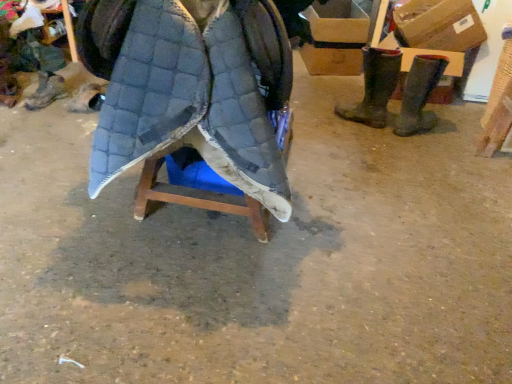
Question: Can you confirm if brown suede boots at right, which ranks as the first footwear in right-to-left order, is thinner than quilted fabric cloak at center?

Choices:
 (A) no
 (B) yes

Answer: (B)

Question: Can you confirm if brown suede boots at right, which ranks as the first footwear in right-to-left order, is bigger than quilted fabric cloak at center?

Choices:
 (A) no
 (B) yes

Answer: (A)

Question: Can we say brown suede boots at right, acting as the fourth footwear starting from the left, lies outside quilted fabric cloak at center?

Choices:
 (A) no
 (B) yes

Answer: (B)

Question: Does brown suede boots at right, acting as the fourth footwear starting from the left, turn towards quilted fabric cloak at center?

Choices:
 (A) yes
 (B) no

Answer: (A)

Question: From a real-world perspective, is brown suede boots at right, acting as the fourth footwear starting from the left, on top of quilted fabric cloak at center?

Choices:
 (A) no
 (B) yes

Answer: (A)

Question: Visually, is quilted fabric cloak at center positioned to the left or to the right of cardboard box at upper right, placed as the 2th cardboard box when sorted from back to front?

Choices:
 (A) left
 (B) right

Answer: (A)

Question: Considering the positions of quilted fabric cloak at center and cardboard box at upper right, which is counted as the 1th cardboard box, starting from the right, in the image, is quilted fabric cloak at center taller or shorter than cardboard box at upper right, which is counted as the 1th cardboard box, starting from the right,?

Choices:
 (A) tall
 (B) short

Answer: (A)

Question: Considering the positions of quilted fabric cloak at center and cardboard box at upper right, which ranks as the first cardboard box in front-to-back order, in the image, is quilted fabric cloak at center bigger or smaller than cardboard box at upper right, which ranks as the first cardboard box in front-to-back order,?

Choices:
 (A) big
 (B) small

Answer: (A)

Question: Is quilted fabric cloak at center inside or outside of cardboard box at upper right, which is counted as the 1th cardboard box, starting from the right?

Choices:
 (A) inside
 (B) outside

Answer: (B)

Question: Do you think brown rubber boots at right, arranged as the second footwear when viewed from the right, is within cardboard box at upper right, the 2th cardboard box from the left, or outside of it?

Choices:
 (A) outside
 (B) inside

Answer: (A)

Question: Is brown rubber boots at right, the 3th footwear from the left, in front of or behind cardboard box at upper right, placed as the 2th cardboard box when sorted from back to front, in the image?

Choices:
 (A) front
 (B) behind

Answer: (A)

Question: From the image's perspective, is brown rubber boots at right, arranged as the second footwear when viewed from the right, located above or below cardboard box at upper right, placed as the 2th cardboard box when sorted from back to front?

Choices:
 (A) below
 (B) above

Answer: (A)

Question: Considering the positions of brown rubber boots at right, arranged as the second footwear when viewed from the right, and cardboard box at upper right, which is counted as the 1th cardboard box, starting from the right, in the image, is brown rubber boots at right, arranged as the second footwear when viewed from the right, bigger or smaller than cardboard box at upper right, which is counted as the 1th cardboard box, starting from the right,?

Choices:
 (A) big
 (B) small

Answer: (B)

Question: From the image's perspective, is brown rubber boots at right, the 3th footwear from the left, above or below cardboard box at upper right, which appears as the 1th cardboard box when viewed from the back?

Choices:
 (A) above
 (B) below

Answer: (B)

Question: Would you say brown rubber boots at right, arranged as the second footwear when viewed from the right, is to the left or to the right of cardboard box at upper right, which appears as the 1th cardboard box when viewed from the back, in the picture?

Choices:
 (A) left
 (B) right

Answer: (B)